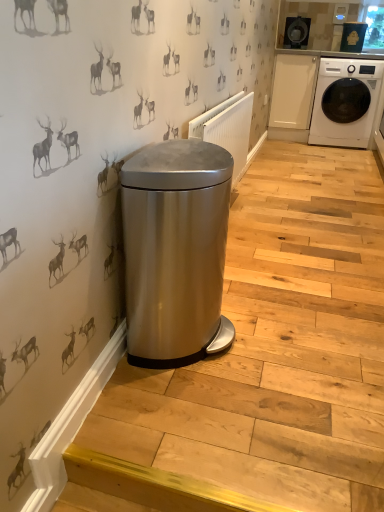
Question: Is satin silver radiator at center facing towards stainless steel trash can at lower left?

Choices:
 (A) yes
 (B) no

Answer: (A)

Question: Is satin silver radiator at center next to stainless steel trash can at lower left and touching it?

Choices:
 (A) no
 (B) yes

Answer: (A)

Question: Is satin silver radiator at center positioned beyond the bounds of stainless steel trash can at lower left?

Choices:
 (A) yes
 (B) no

Answer: (A)

Question: Considering the relative sizes of satin silver radiator at center and stainless steel trash can at lower left in the image provided, is satin silver radiator at center taller than stainless steel trash can at lower left?

Choices:
 (A) yes
 (B) no

Answer: (A)

Question: Is satin silver radiator at center facing away from stainless steel trash can at lower left?

Choices:
 (A) no
 (B) yes

Answer: (A)

Question: Is satin silver radiator at center in front of or behind white glossy washing machine at right in the image?

Choices:
 (A) front
 (B) behind

Answer: (A)

Question: Is satin silver radiator at center taller or shorter than white glossy washing machine at right?

Choices:
 (A) tall
 (B) short

Answer: (B)

Question: From a real-world perspective, is satin silver radiator at center physically located above or below white glossy washing machine at right?

Choices:
 (A) below
 (B) above

Answer: (A)

Question: In terms of width, does satin silver radiator at center look wider or thinner when compared to white glossy washing machine at right?

Choices:
 (A) thin
 (B) wide

Answer: (A)

Question: From the image's perspective, relative to satin silver trash can at center, is satin silver radiator at center above or below?

Choices:
 (A) below
 (B) above

Answer: (B)

Question: Would you say satin silver radiator at center is to the left or to the right of satin silver trash can at center in the picture?

Choices:
 (A) right
 (B) left

Answer: (A)

Question: In terms of height, does satin silver radiator at center look taller or shorter compared to satin silver trash can at center?

Choices:
 (A) short
 (B) tall

Answer: (A)

Question: From a real-world perspective, is satin silver radiator at center positioned above or below satin silver trash can at center?

Choices:
 (A) above
 (B) below

Answer: (A)

Question: Considering the positions of white glossy washing machine at right and stainless steel trash can at lower left in the image, is white glossy washing machine at right taller or shorter than stainless steel trash can at lower left?

Choices:
 (A) tall
 (B) short

Answer: (A)

Question: Considering the positions of white glossy washing machine at right and stainless steel trash can at lower left in the image, is white glossy washing machine at right bigger or smaller than stainless steel trash can at lower left?

Choices:
 (A) small
 (B) big

Answer: (B)